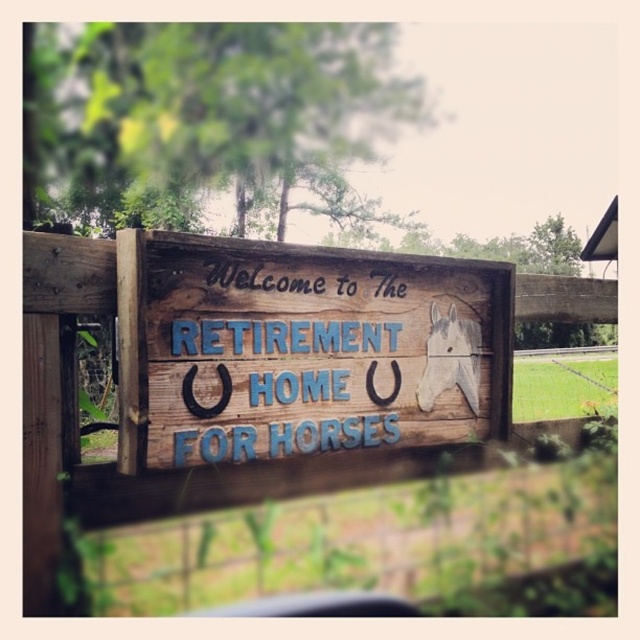
Question: Among these points, which one is farthest from the camera?

Choices:
 (A) (330, 408)
 (B) (221, 417)

Answer: (A)

Question: Is weathered wood sign at center wider than white painted wood horse at center?

Choices:
 (A) no
 (B) yes

Answer: (B)

Question: Which object is closer to the camera taking this photo?

Choices:
 (A) weathered wood sign at center
 (B) white painted wood horse at center

Answer: (A)

Question: Is weathered wood sign at center positioned in front of white painted wood horse at center?

Choices:
 (A) yes
 (B) no

Answer: (A)

Question: Which of the following is the closest to the observer?

Choices:
 (A) (474, 381)
 (B) (461, 380)

Answer: (B)

Question: Can you confirm if weathered wood sign at center is wider than white painted wood horse at center?

Choices:
 (A) yes
 (B) no

Answer: (A)